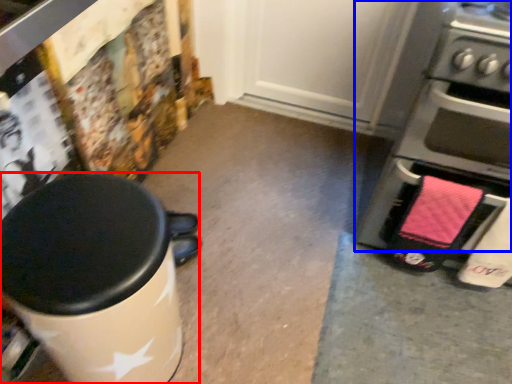
Question: Which object is further to the camera taking this photo, waste container (highlighted by a red box) or home appliance (highlighted by a blue box)?

Choices:
 (A) waste container
 (B) home appliance

Answer: (B)